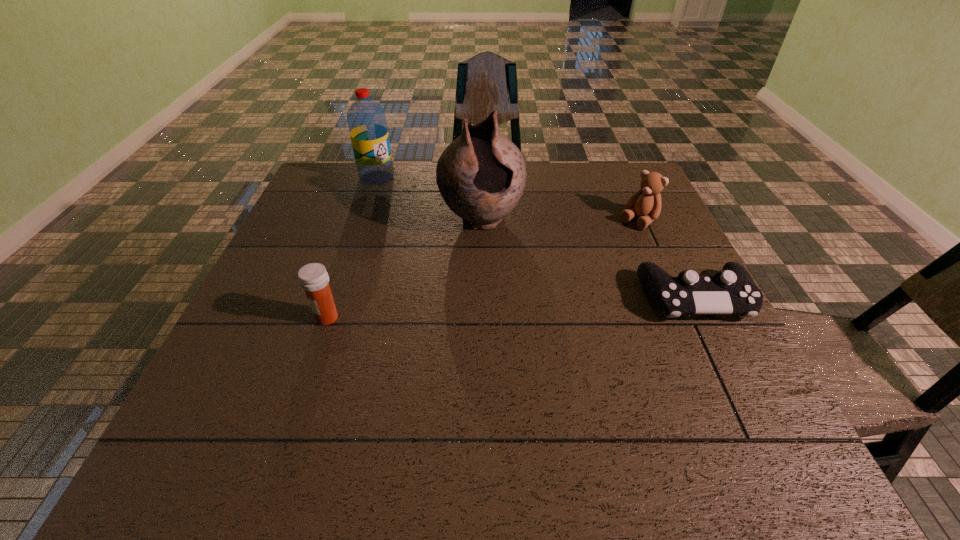
You are a GUI agent. You are given a task and a screenshot of the screen. Output one action in this format:
    pyautogui.click(x=<x>, y=<y>)
    Task: Click on the water bottle positioned at the far edge
    The image size is (960, 540).
    Given the screenshot: What is the action you would take?
    pyautogui.click(x=366, y=119)

The width and height of the screenshot is (960, 540). What are the coordinates of `medicine that is at the left edge` in the screenshot? It's located at (313, 278).

The height and width of the screenshot is (540, 960). In order to click on water bottle present at the left edge in this screenshot , I will do `click(366, 119)`.

Identify the location of control at the right edge. The height and width of the screenshot is (540, 960). (731, 290).

The width and height of the screenshot is (960, 540). In order to click on teddy bear present at the right edge in this screenshot , I will do click(646, 203).

Identify the location of object present at the far left corner. Image resolution: width=960 pixels, height=540 pixels. (366, 119).

Locate an element on the screen. vacant region at the far edge of the desktop is located at coordinates (381, 203).

Locate an element on the screen. vacant space at the near edge of the desktop is located at coordinates (380, 386).

In the image, there is a desktop. Find the location of `vacant space at the left edge`. vacant space at the left edge is located at coordinates (262, 320).

In order to click on free space at the right edge in this screenshot , I will do `click(675, 261)`.